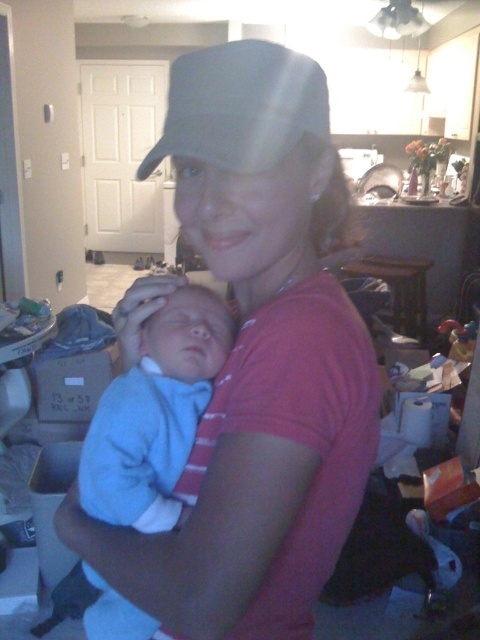
Who is positioned more to the left, matte pink shirt at center or light blue soft fabric newborn at center?

Positioned to the left is light blue soft fabric newborn at center.

Which of these two, matte pink shirt at center or light blue soft fabric newborn at center, stands shorter?

Standing shorter between the two is light blue soft fabric newborn at center.

Describe the element at coordinates (255, 360) in the screenshot. The image size is (480, 640). I see `matte pink shirt at center` at that location.

Find the location of `matte pink shirt at center`. matte pink shirt at center is located at coordinates (255, 360).

Does light blue soft fabric newborn at center have a lesser height compared to gray fabric baseball cap at upper center?

Incorrect, light blue soft fabric newborn at center's height does not fall short of gray fabric baseball cap at upper center's.

Does point (137, 480) come in front of point (189, 120)?

No.

Find the location of `light blue soft fabric newborn at center`. light blue soft fabric newborn at center is located at coordinates (155, 413).

Who is more distant from viewer, (227, 509) or (224, 45)?

The point (224, 45) is more distant.

Between matte pink shirt at center and gray fabric baseball cap at upper center, which one is positioned higher?

gray fabric baseball cap at upper center is higher up.

Which is in front, point (286, 120) or point (231, 163)?

Point (231, 163) is more forward.

The height and width of the screenshot is (640, 480). I want to click on matte pink shirt at center, so click(255, 360).